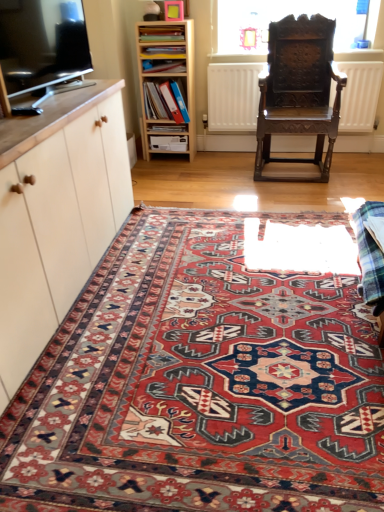
I want to click on vacant position to the left of dark brown wood chair at center, so click(x=225, y=174).